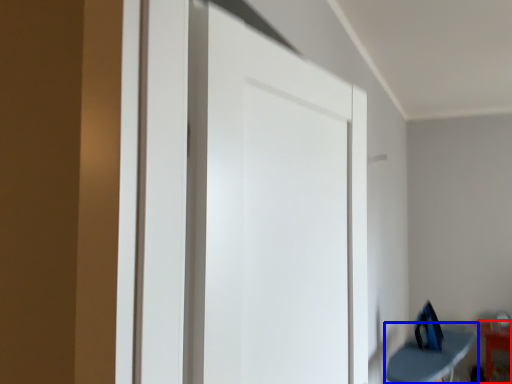
Question: Which object appears closest to the camera in this image, furniture (highlighted by a red box) or furniture (highlighted by a blue box)?

Choices:
 (A) furniture
 (B) furniture

Answer: (B)